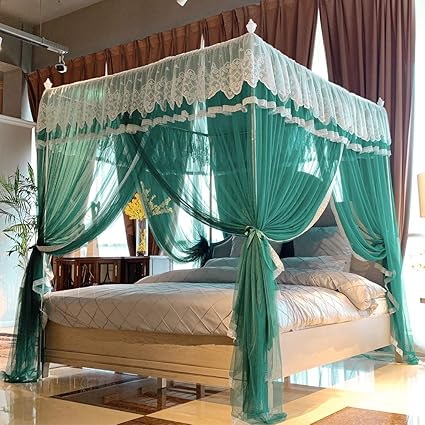
Find the location of a particular element. desk is located at coordinates (99, 267).